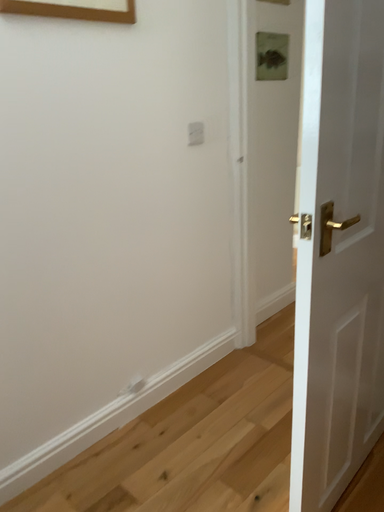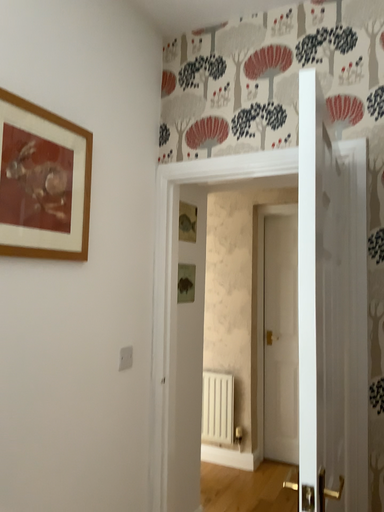
Question: Which way did the camera rotate in the video?

Choices:
 (A) rotated right
 (B) rotated left

Answer: (A)